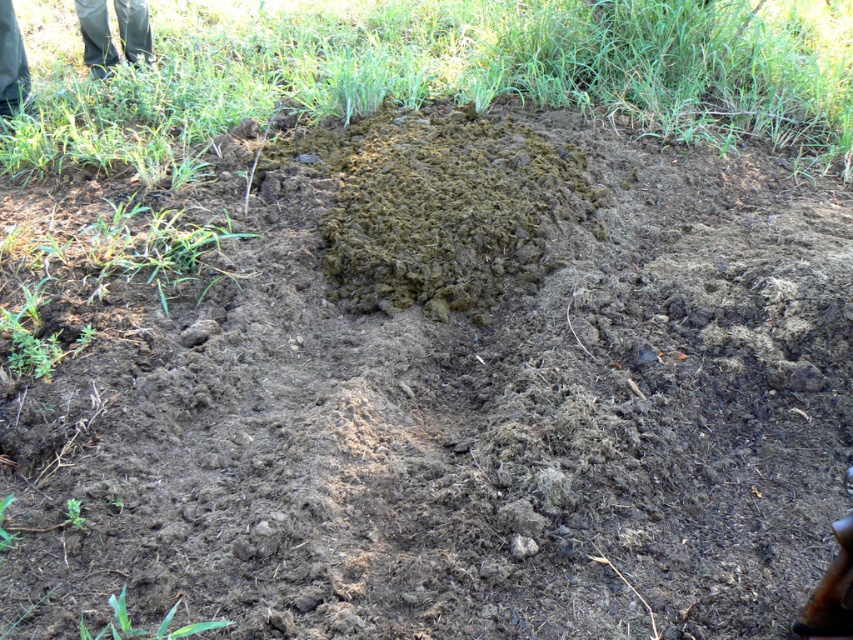
You are a gardener wearing the green rubber boots at upper left and need to reach the brown soil mound at center to check its moisture level. Can you comfortably step to the mound without needing to take more than two steps?

The distance between the brown soil mound at center and the green rubber boots at upper left is 1.93 meters. Since an average step is about 0.75 meters, two steps would cover 1.5 meters, which is slightly less than the required distance. Therefore, you would need to take three steps to comfortably reach the mound.

You are a gardener who needs to step onto the brown soil mound at center to plant a tree. However, you are wearing the green rubber boots at upper left. Will stepping onto the mound cause your boots to sink into the soil?

The brown soil mound at center is in front of the green rubber boots at upper left, meaning the boots are not currently on the mound. However, the soil appears moist and crumbly, so stepping on it might cause some sinking. Check the soil firmness before stepping.

You are a gardener planning to plant a row of flowers in the garden. The soil mound is in the way. Where exactly is the brown soil mound at center located in the image?

The brown soil mound at center is located at the coordinates point (442, 205) in the image.